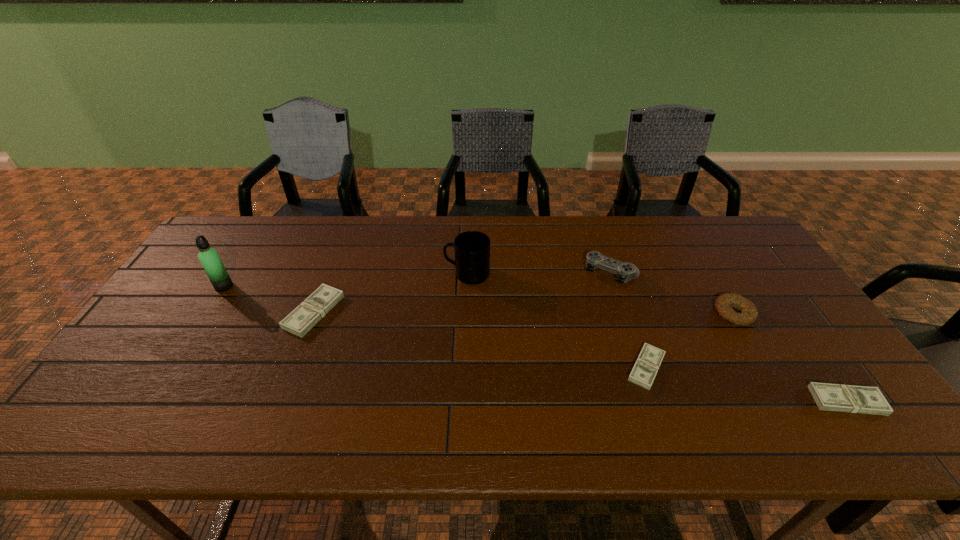
If equal spacing is desired by inserting an extra money among them, please point out a free spot for this new money. Please provide its 2D coordinates. Your answer should be formatted as a tuple, i.e. [(x, y)], where the tuple contains the x and y coordinates of a point satisfying the conditions above.

[(470, 338)]